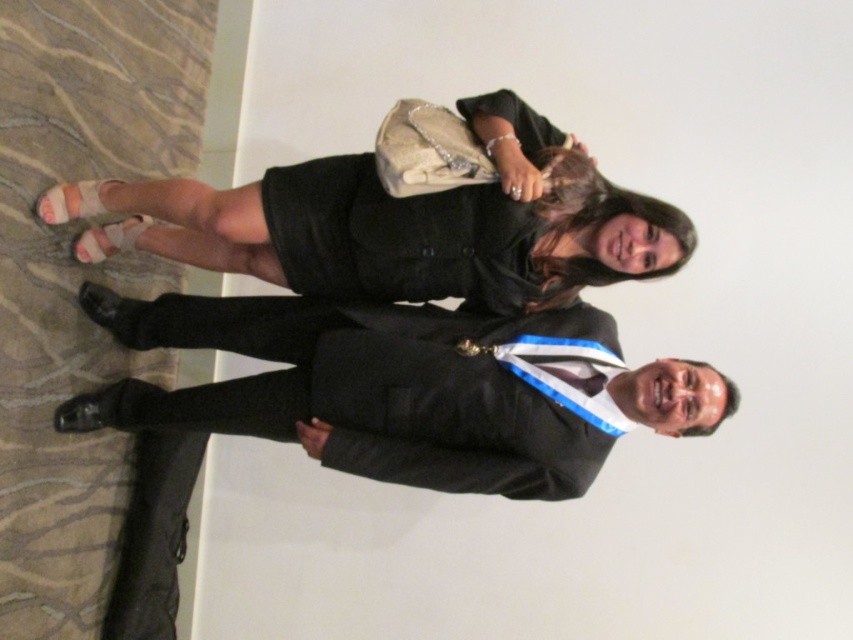
You are a photographer at a formal event. You need to position two subjects so that their outfits are clearly visible. The black fabric dress at upper center and the black matte suit at center are both in your frame. Based on their heights, which outfit should you focus on to ensure it stands out more due to its height?

The black fabric dress at upper center is taller than the black matte suit at center, so focusing on the black fabric dress at upper center would make it stand out more due to its greater height.

You are organizing a charity event and need to arrange seating for two guests wearing the black fabric dress at upper center and the black matte suit at center. Which guest should you seat in a wider chair to accommodate their outfit?

The black fabric dress at upper center might be wider than the black matte suit at center, so you should seat the guest wearing the black fabric dress at upper center in the wider chair to ensure comfort and proper fit.